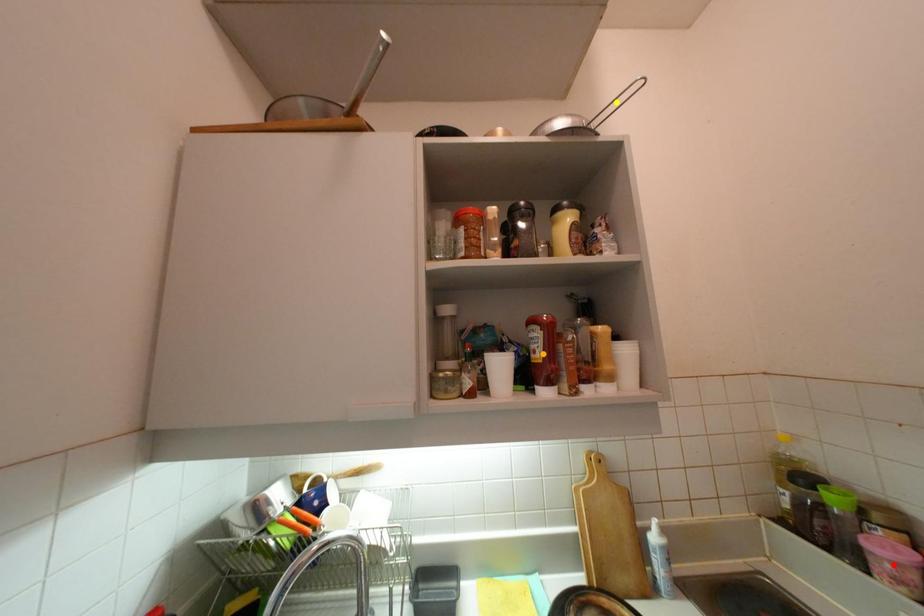
Order these from farthest to nearest:
red point | orange point | yellow point

orange point
yellow point
red point